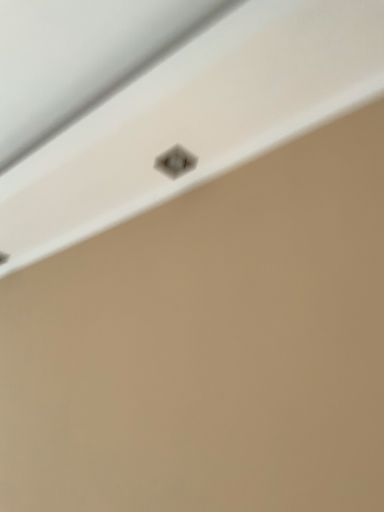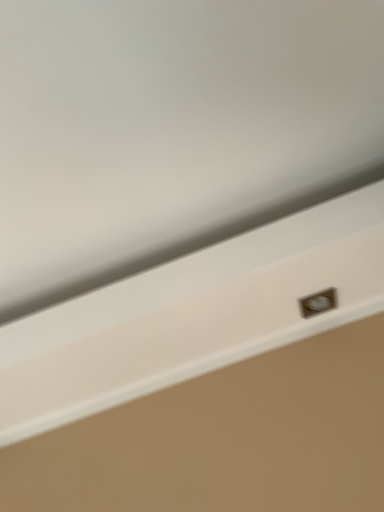
Question: Which way did the camera rotate in the video?

Choices:
 (A) rotated left
 (B) rotated right

Answer: (B)